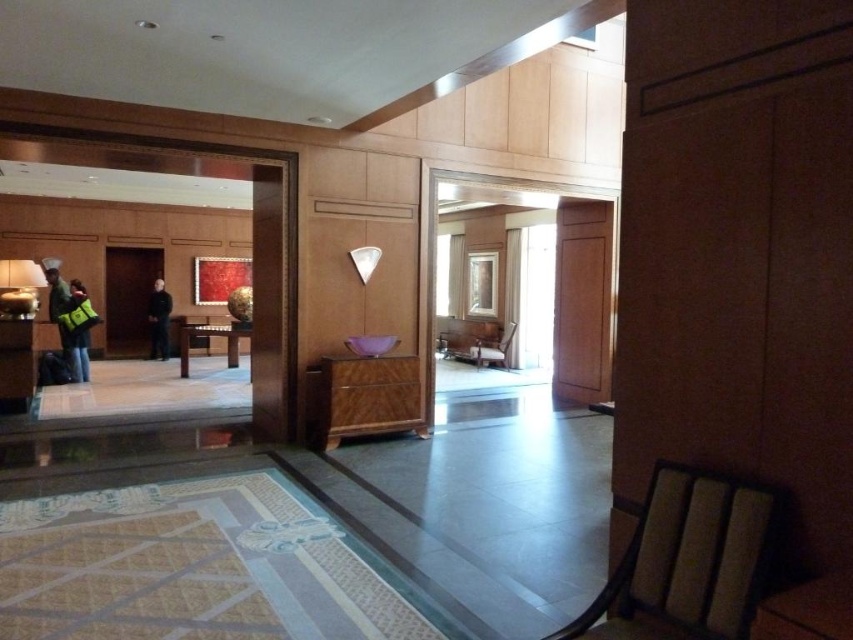
Question: Which point appears closest to the camera in this image?

Choices:
 (A) (152, 356)
 (B) (85, 353)

Answer: (B)

Question: Is reflective green jacket at left positioned in front of black matte jacket at center?

Choices:
 (A) yes
 (B) no

Answer: (A)

Question: Does reflective green jacket at left come behind black matte jacket at center?

Choices:
 (A) no
 (B) yes

Answer: (A)

Question: From the image, what is the correct spatial relationship of reflective green jacket at left in relation to black matte jacket at center?

Choices:
 (A) below
 (B) above

Answer: (A)